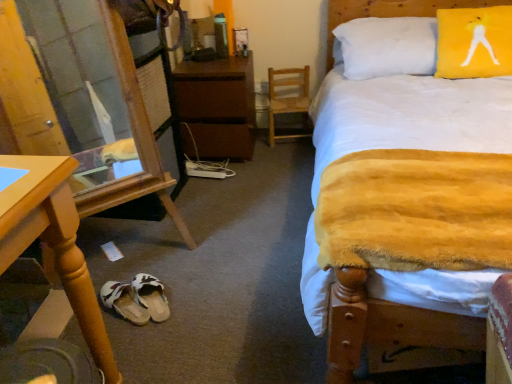
Identify the location of free space between wooden swivel chair at center and brown matte nightstand at center. (270, 148).